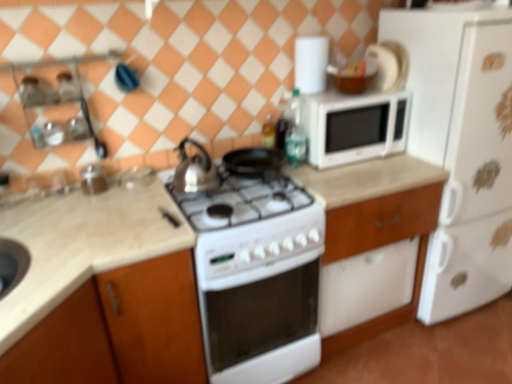
Question: Are white matte refrigerator at right and green glass bottle at upper right, marked as the second bottle in a left-to-right arrangement, beside each other?

Choices:
 (A) no
 (B) yes

Answer: (A)

Question: Considering the relative sizes of white matte refrigerator at right and green glass bottle at upper right, acting as the first bottle starting from the right, in the image provided, is white matte refrigerator at right taller than green glass bottle at upper right, acting as the first bottle starting from the right,?

Choices:
 (A) yes
 (B) no

Answer: (A)

Question: Considering the relative sizes of white matte refrigerator at right and green glass bottle at upper right, acting as the first bottle starting from the right, in the image provided, is white matte refrigerator at right wider than green glass bottle at upper right, acting as the first bottle starting from the right,?

Choices:
 (A) no
 (B) yes

Answer: (B)

Question: From a real-world perspective, is white matte refrigerator at right on green glass bottle at upper right, marked as the second bottle in a left-to-right arrangement?

Choices:
 (A) yes
 (B) no

Answer: (B)

Question: From a real-world perspective, is white matte refrigerator at right physically below green glass bottle at upper right, acting as the first bottle starting from the right?

Choices:
 (A) no
 (B) yes

Answer: (B)

Question: Is point (205, 175) closer or farther from the camera than point (324, 104)?

Choices:
 (A) closer
 (B) farther

Answer: (A)

Question: Is silver metallic kettle at center in front of or behind white matte microwave at upper center in the image?

Choices:
 (A) front
 (B) behind

Answer: (A)

Question: Is silver metallic kettle at center to the left or to the right of white matte microwave at upper center in the image?

Choices:
 (A) right
 (B) left

Answer: (B)

Question: From a real-world perspective, relative to white matte microwave at upper center, is silver metallic kettle at center vertically above or below?

Choices:
 (A) below
 (B) above

Answer: (A)

Question: In terms of width, does white glossy microwave at upper right, which ranks as the second appliance in left-to-right order, look wider or thinner when compared to white matte microwave at upper center?

Choices:
 (A) thin
 (B) wide

Answer: (A)

Question: In the image, is white glossy microwave at upper right, acting as the first appliance starting from the right, on the left side or the right side of white matte microwave at upper center?

Choices:
 (A) left
 (B) right

Answer: (B)

Question: Would you say white glossy microwave at upper right, acting as the first appliance starting from the right, is inside or outside white matte microwave at upper center?

Choices:
 (A) outside
 (B) inside

Answer: (A)

Question: In terms of height, does white glossy microwave at upper right, the 1th appliance in the back-to-front sequence, look taller or shorter compared to white matte microwave at upper center?

Choices:
 (A) short
 (B) tall

Answer: (A)

Question: From the image's perspective, relative to transparent glass jar at upper left, the 1th appliance when ordered from left to right, is translucent glass bottle at upper center, acting as the second bottle starting from the right, above or below?

Choices:
 (A) above
 (B) below

Answer: (A)

Question: Considering the positions of translucent glass bottle at upper center, acting as the second bottle starting from the right, and transparent glass jar at upper left, which appears as the second appliance when viewed from the right, in the image, is translucent glass bottle at upper center, acting as the second bottle starting from the right, taller or shorter than transparent glass jar at upper left, which appears as the second appliance when viewed from the right,?

Choices:
 (A) short
 (B) tall

Answer: (B)